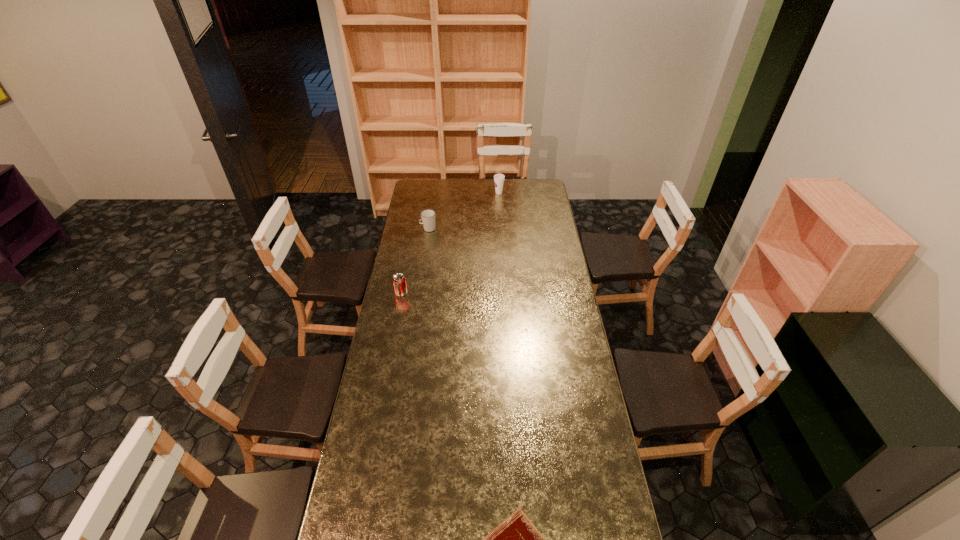
The image size is (960, 540). I want to click on object that stands as the closest to the farthest object, so click(427, 216).

Identify the location of the third closest object to the farthest object. This screenshot has width=960, height=540. (516, 539).